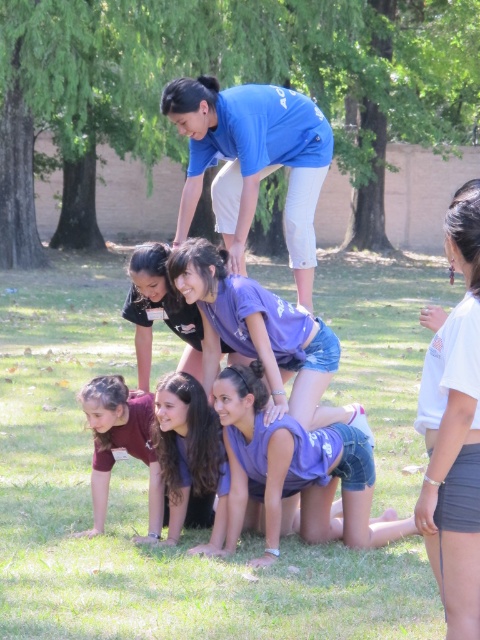
Based on the photo, which is above, white cotton t-shirt at lower right or purple cotton shirt at center?

purple cotton shirt at center

Does white cotton t-shirt at lower right have a lesser height compared to purple cotton shirt at center?

No, white cotton t-shirt at lower right is not shorter than purple cotton shirt at center.

At what (x,y) coordinates should I click in order to perform the action: click on white cotton t-shirt at lower right. Please return your answer as a coordinate pair (x, y). This screenshot has height=640, width=480. Looking at the image, I should click on pyautogui.click(x=455, y=433).

Between blue cotton shirt at upper center and maroon fabric shirt at lower left, which one appears on the right side from the viewer's perspective?

From the viewer's perspective, blue cotton shirt at upper center appears more on the right side.

Measure the distance between blue cotton shirt at upper center and maroon fabric shirt at lower left.

1.66 meters

The image size is (480, 640). Identify the location of blue cotton shirt at upper center. (252, 161).

Where is `blue cotton shirt at upper center`? This screenshot has height=640, width=480. blue cotton shirt at upper center is located at coordinates (252, 161).

Is green grass at center above purple cotton shirt at center?

Yes.

Does point (115, 285) come in front of point (180, 268)?

That is False.

Does point (337, 392) lie behind point (259, 312)?

Yes.

Identify the location of green grass at center. (145, 506).